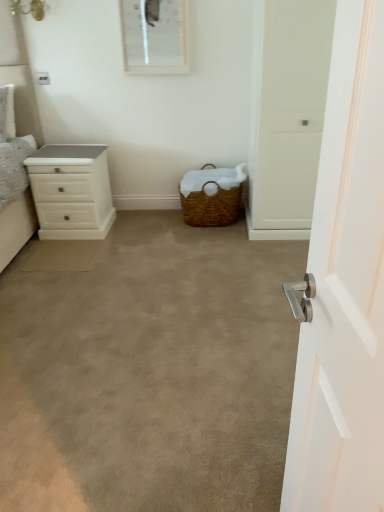
You are a GUI agent. You are given a task and a screenshot of the screen. Output one action in this format:
    pyautogui.click(x=<x>, y=<y>)
    Task: Click on the white matte door handle at right
    Image resolution: width=384 pixels, height=512 pixels.
    Given the screenshot: What is the action you would take?
    pyautogui.click(x=344, y=287)

Describe the element at coordinates (155, 36) in the screenshot. I see `white glossy picture frame at upper center` at that location.

What is the approximate height of white glossy picture frame at upper center?

The height of white glossy picture frame at upper center is 49.71 centimeters.

What do you see at coordinates (71, 191) in the screenshot?
I see `white glossy chest of drawers at left` at bounding box center [71, 191].

Find the location of `white glossy chest of drawers at left`. white glossy chest of drawers at left is located at coordinates (71, 191).

Identify the location of beige carpet at center. (148, 371).

What's the angular difference between beige carpet at center and white glossy chest of drawers at left's facing directions?

The angle between the facing direction of beige carpet at center and the facing direction of white glossy chest of drawers at left is 1.22 degrees.

From the image's perspective, which is above, beige carpet at center or white glossy chest of drawers at left?

white glossy chest of drawers at left, from the image's perspective.

Can you confirm if beige carpet at center is wider than white glossy chest of drawers at left?

Yes.

Is beige carpet at center completely or partially outside of white glossy chest of drawers at left?

Yes, beige carpet at center is located beyond the bounds of white glossy chest of drawers at left.

From a real-world perspective, is woven brown picnic basket at center beneath white matte door handle at right?

Correct, in the physical world, woven brown picnic basket at center is lower than white matte door handle at right.

Is woven brown picnic basket at center positioned with its back to white matte door handle at right?

No, woven brown picnic basket at center's orientation is not away from white matte door handle at right.

The height and width of the screenshot is (512, 384). Identify the location of door below the woven brown picnic basket at center (from the image's perspective). (344, 287).

Considering the relative sizes of woven brown picnic basket at center and white matte door handle at right in the image provided, is woven brown picnic basket at center wider than white matte door handle at right?

Indeed, woven brown picnic basket at center has a greater width compared to white matte door handle at right.

Is beige carpet at center inside woven brown picnic basket at center?

No, beige carpet at center is located outside of woven brown picnic basket at center.

From a real-world perspective, is woven brown picnic basket at center on beige carpet at center?

Yes.

Where is `plain in front of the woven brown picnic basket at center`? plain in front of the woven brown picnic basket at center is located at coordinates (148, 371).

Considering the sizes of beige carpet at center and white glossy picture frame at upper center in the image, is beige carpet at center wider or thinner than white glossy picture frame at upper center?

Clearly, beige carpet at center has more width compared to white glossy picture frame at upper center.

Does beige carpet at center touch white glossy picture frame at upper center?

No, beige carpet at center is not beside white glossy picture frame at upper center.

Is white glossy chest of drawers at left situated inside beige carpet at center or outside?

white glossy chest of drawers at left is spatially situated outside beige carpet at center.

Which object is positioned more to the left, white glossy chest of drawers at left or beige carpet at center?

Positioned to the left is white glossy chest of drawers at left.

Does white glossy chest of drawers at left have a greater width compared to beige carpet at center?

No.

Visually, is white matte door handle at right positioned to the left or to the right of white glossy picture frame at upper center?

Based on their positions, white matte door handle at right is located to the right of white glossy picture frame at upper center.

You are a GUI agent. You are given a task and a screenshot of the screen. Output one action in this format:
    pyautogui.click(x=<x>, y=<y>)
    Task: Click on the picture frame above the white matte door handle at right (from the image's perspective)
    This screenshot has width=384, height=512.
    Given the screenshot: What is the action you would take?
    pyautogui.click(x=155, y=36)

Which is in front, point (373, 243) or point (153, 68)?

The point (373, 243) is closer to the camera.

Based on the photo, relative to white glossy picture frame at upper center, is white matte door handle at right in front or behind?

In the image, white matte door handle at right appears in front of white glossy picture frame at upper center.

What's the angular difference between white glossy chest of drawers at left and white glossy picture frame at upper center's facing directions?

white glossy chest of drawers at left and white glossy picture frame at upper center are facing 1.22 degrees away from each other.

Does white glossy chest of drawers at left have a lesser height compared to white glossy picture frame at upper center?

Incorrect, the height of white glossy chest of drawers at left does not fall short of that of white glossy picture frame at upper center.

Considering the sizes of white glossy chest of drawers at left and white glossy picture frame at upper center in the image, is white glossy chest of drawers at left bigger or smaller than white glossy picture frame at upper center?

In the image, white glossy chest of drawers at left appears to be larger than white glossy picture frame at upper center.

The image size is (384, 512). I want to click on plain in front of the white glossy chest of drawers at left, so click(x=148, y=371).

Find the location of a particular element. picnic basket located behind the white matte door handle at right is located at coordinates (211, 196).

When comparing their distances from beige carpet at center, does white glossy chest of drawers at left or white matte door handle at right seem closer?

Among the two, white glossy chest of drawers at left is located nearer to beige carpet at center.

Which object lies nearer to the anchor point beige carpet at center, white matte door handle at right or white glossy chest of drawers at left?

Based on the image, white glossy chest of drawers at left appears to be nearer to beige carpet at center.

Which object lies nearer to the anchor point white matte door handle at right, white glossy chest of drawers at left or woven brown picnic basket at center?

woven brown picnic basket at center is closer to white matte door handle at right.

Which object lies further to the anchor point white glossy picture frame at upper center, white glossy chest of drawers at left or woven brown picnic basket at center?

Among the two, woven brown picnic basket at center is located further to white glossy picture frame at upper center.

Consider the image. Looking at the image, which one is located closer to white glossy picture frame at upper center, woven brown picnic basket at center or white matte door handle at right?

woven brown picnic basket at center is closer to white glossy picture frame at upper center.

Which object lies nearer to the anchor point beige carpet at center, white matte door handle at right or woven brown picnic basket at center?

woven brown picnic basket at center is closer to beige carpet at center.

Based on the photo, looking at the image, which one is located closer to white glossy chest of drawers at left, white matte door handle at right or woven brown picnic basket at center?

woven brown picnic basket at center is closer to white glossy chest of drawers at left.

From the image, which object appears to be nearer to white glossy picture frame at upper center, woven brown picnic basket at center or white glossy chest of drawers at left?

white glossy chest of drawers at left.

Locate an element on the screen. This screenshot has width=384, height=512. chest of drawers between beige carpet at center and woven brown picnic basket at center in the front-back direction is located at coordinates (71, 191).

This screenshot has height=512, width=384. I want to click on plain between white matte door handle at right and woven brown picnic basket at center in the front-back direction, so [148, 371].

Find the location of `plain between white matte door handle at right and white glossy chest of drawers at left in the front-back direction`. plain between white matte door handle at right and white glossy chest of drawers at left in the front-back direction is located at coordinates (148, 371).

At what (x,y) coordinates should I click in order to perform the action: click on the chest of drawers located between beige carpet at center and white glossy picture frame at upper center in the depth direction. Please return your answer as a coordinate pair (x, y). Looking at the image, I should click on (71, 191).